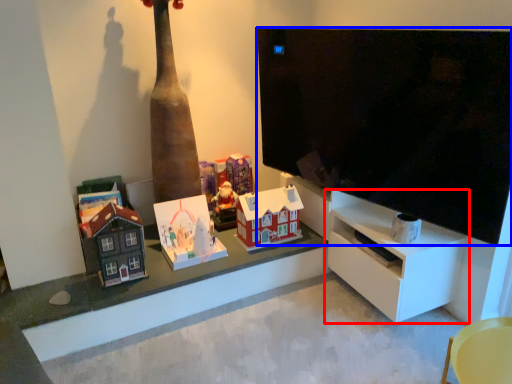
Question: Which of the following is the closest to the observer, shelf (highlighted by a red box) or television (highlighted by a blue box)?

Choices:
 (A) shelf
 (B) television

Answer: (B)